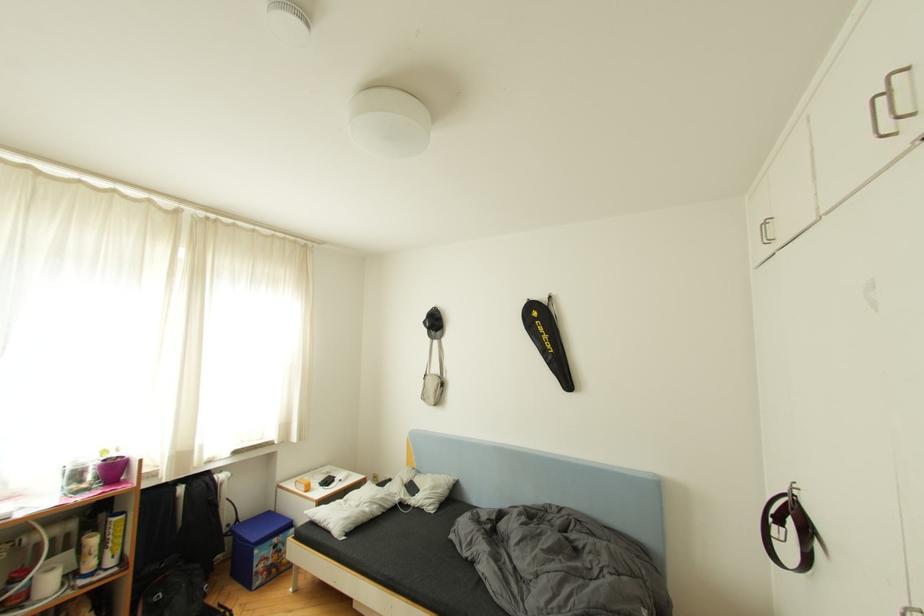
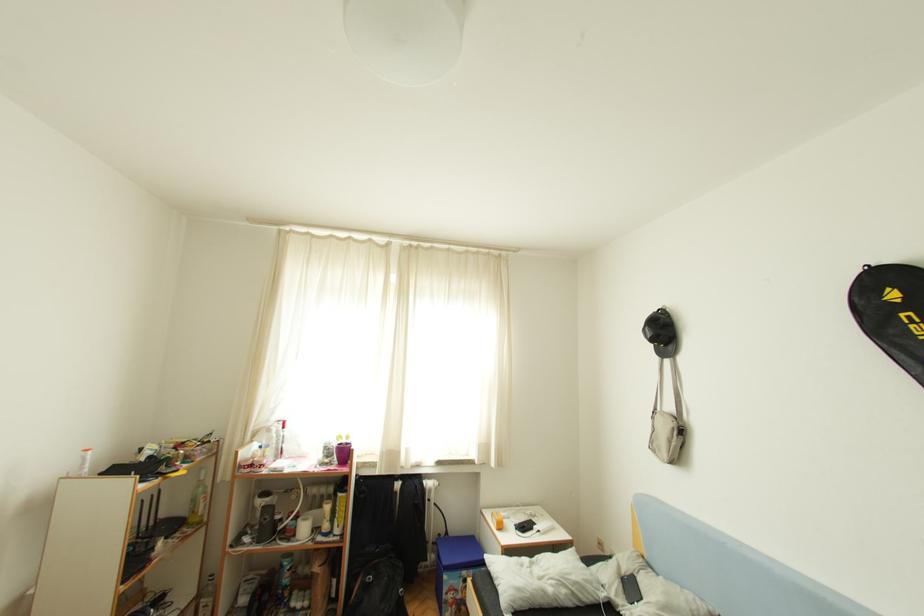
Question: The first image is from the beginning of the video and the second image is from the end. How did the camera likely rotate when shooting the video?

Choices:
 (A) Left
 (B) Right
 (C) Up
 (D) Down

Answer: (A)